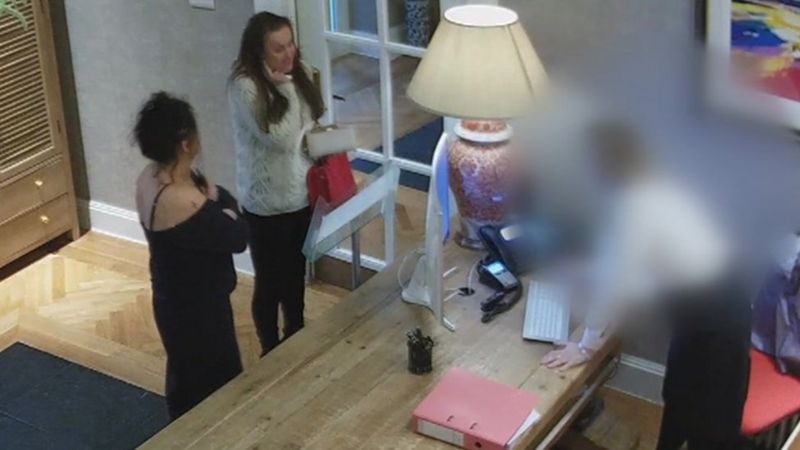
Locate an element on the screen. baseboard is located at coordinates (634, 392).